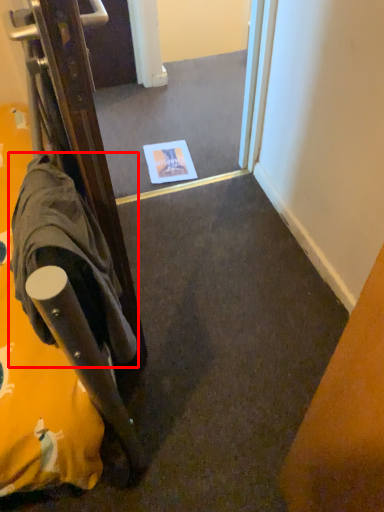
Question: From the image's perspective, where is robe (annotated by the red box) located in relation to mirror in the image?

Choices:
 (A) above
 (B) below

Answer: (B)